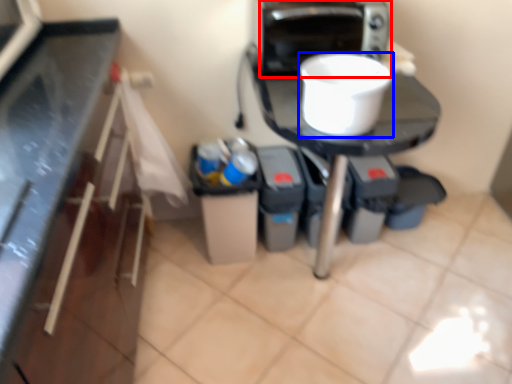
Question: Which object appears closest to the camera in this image, home appliance (highlighted by a red box) or kitchen appliance (highlighted by a blue box)?

Choices:
 (A) home appliance
 (B) kitchen appliance

Answer: (B)